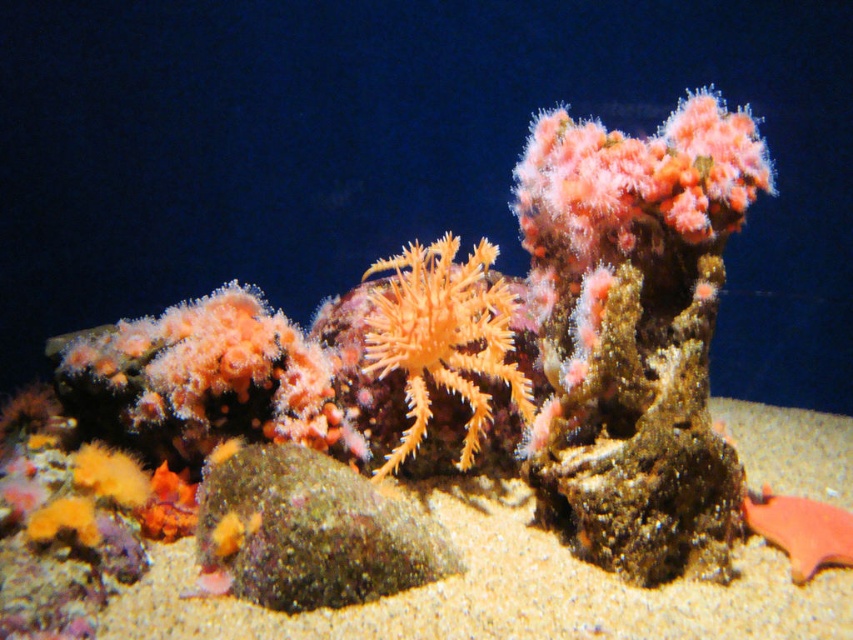
Question: Which object is positioned closest to the sandy textured sand at center?

Choices:
 (A) smooth orange fish at lower right
 (B) orange soft coral at center

Answer: (A)

Question: Can you confirm if orange soft coral at center is smaller than smooth orange fish at lower right?

Choices:
 (A) yes
 (B) no

Answer: (B)

Question: Where is orange soft coral at center located in relation to smooth orange fish at lower right in the image?

Choices:
 (A) below
 (B) above

Answer: (B)

Question: Which point is farther from the camera taking this photo?

Choices:
 (A) (792, 504)
 (B) (561, 566)

Answer: (A)

Question: Considering the relative positions of sandy textured sand at center and smooth orange fish at lower right in the image provided, where is sandy textured sand at center located with respect to smooth orange fish at lower right?

Choices:
 (A) above
 (B) below

Answer: (A)

Question: Among these points, which one is farthest from the camera?

Choices:
 (A) (675, 614)
 (B) (809, 564)

Answer: (B)